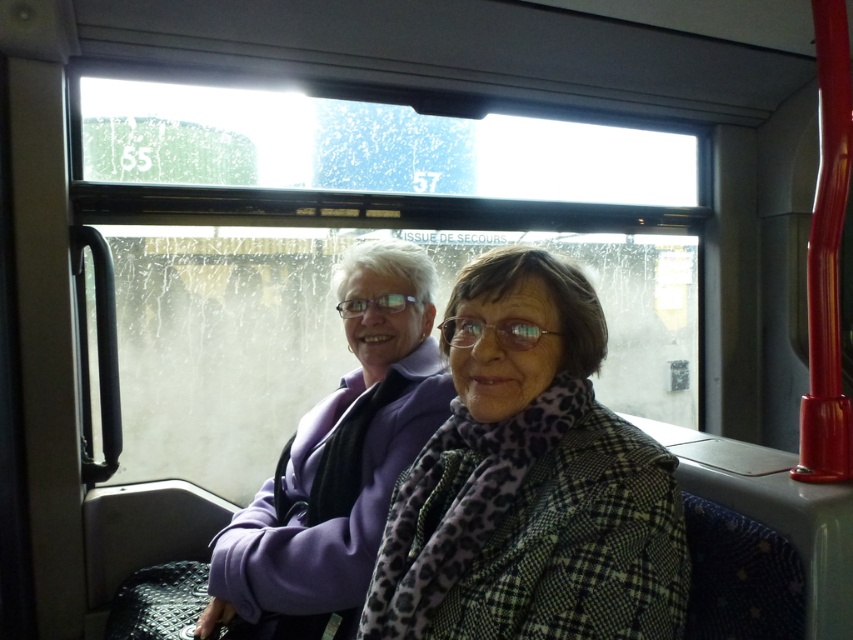
You are a tailor who needs to determine which item requires more fabric for alterations. Based on the image, which item, the green checkered coat at center or the purple fabric at center, would need more fabric due to its thickness?

The purple fabric at center is thicker than the green checkered coat at center, so it would require more fabric for alterations.

You are a passenger on the bus and want to know which item is nearer to you between the green checkered coat at center and the purple fabric at center. Based on the scene, which one is closer?

The green checkered coat at center is closer to the viewer than the purple fabric at center.